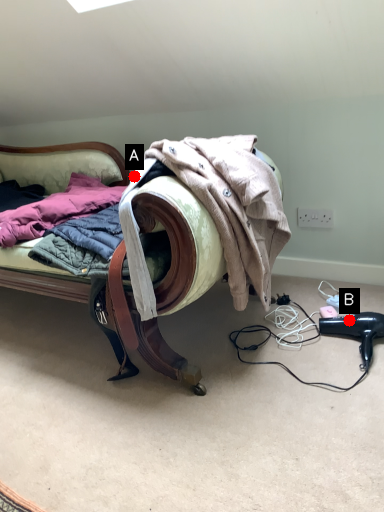
Question: Two points are circled on the image, labeled by A and B beside each circle. Among these points, which one is nearest to the camera?

Choices:
 (A) A is closer
 (B) B is closer

Answer: (A)